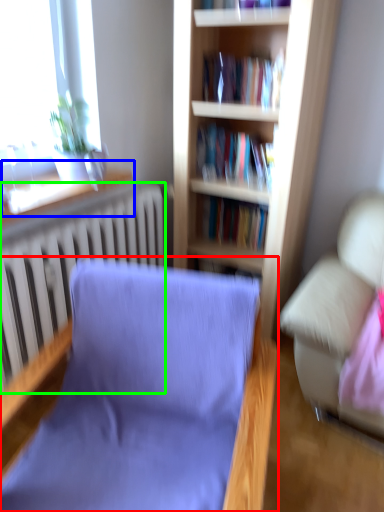
Question: Based on their relative distances, which object is nearer to chair (highlighted by a red box)? Choose from window sill (highlighted by a blue box) and radiator (highlighted by a green box).

Choices:
 (A) window sill
 (B) radiator

Answer: (B)